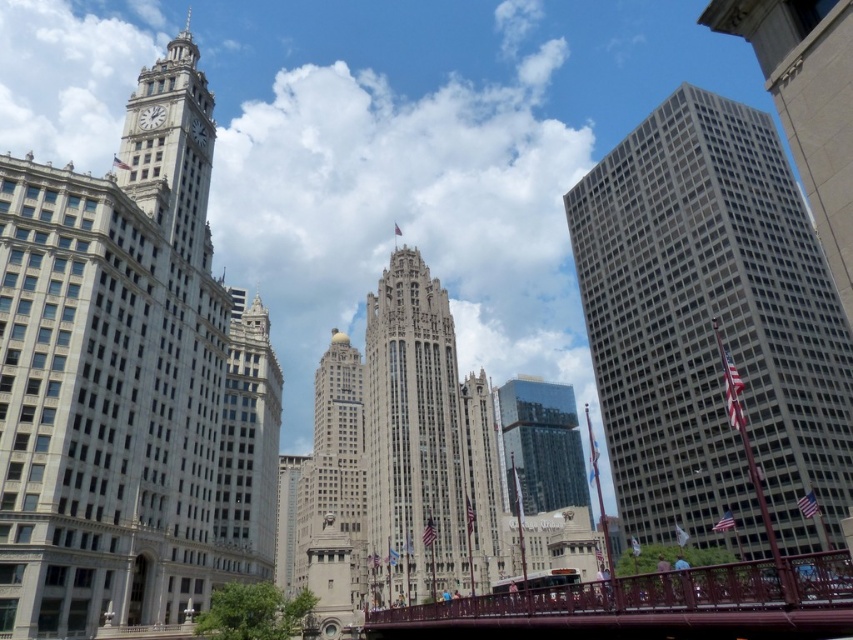
Is gold dome building at center behind glassy reflective skyscraper at center?

No, it is not.

Is gold dome building at center bigger than glassy reflective skyscraper at center?

Yes.

Is point (357, 496) more distant than point (554, 444)?

That is False.

Where is `gold dome building at center`? The height and width of the screenshot is (640, 853). gold dome building at center is located at coordinates (334, 497).

Does gold dome building at center lie behind white stone clock tower at upper left?

Yes, it is behind white stone clock tower at upper left.

Is point (334, 372) farther from viewer compared to point (170, 124)?

Yes, it is.

Which is behind, point (363, 481) or point (140, 157)?

Point (363, 481)

Find the location of a particular element. This screenshot has width=853, height=640. gold dome building at center is located at coordinates (334, 497).

Who is positioned more to the right, gray concrete skyscraper at right or glassy reflective skyscraper at center?

Positioned to the right is glassy reflective skyscraper at center.

Identify the location of gray concrete skyscraper at right. This screenshot has height=640, width=853. (712, 330).

This screenshot has width=853, height=640. What are the coordinates of `gray concrete skyscraper at right` in the screenshot? It's located at (712, 330).